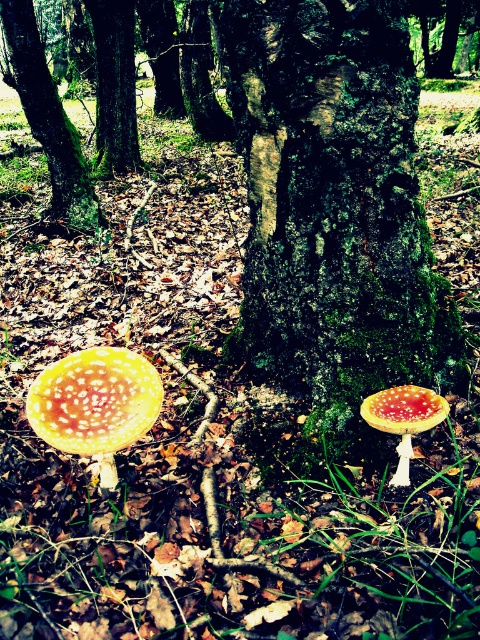
You are standing in the forest and want to place a small fairy statue exactly at the location marked by the green mossy tree at center. According to the coordinates provided, where should you place the fairy statue?

The green mossy tree at center is located at coordinates point (47, 116), so you should place the fairy statue there.

You are a forest creature looking for the largest mushroom to hide under. Which mushroom should you choose between the yellow spotted mushroom at lower left and the yellow spotted mushroom at lower center?

The yellow spotted mushroom at lower left is bigger than the yellow spotted mushroom at lower center, so you should choose the yellow spotted mushroom at lower left to hide under.